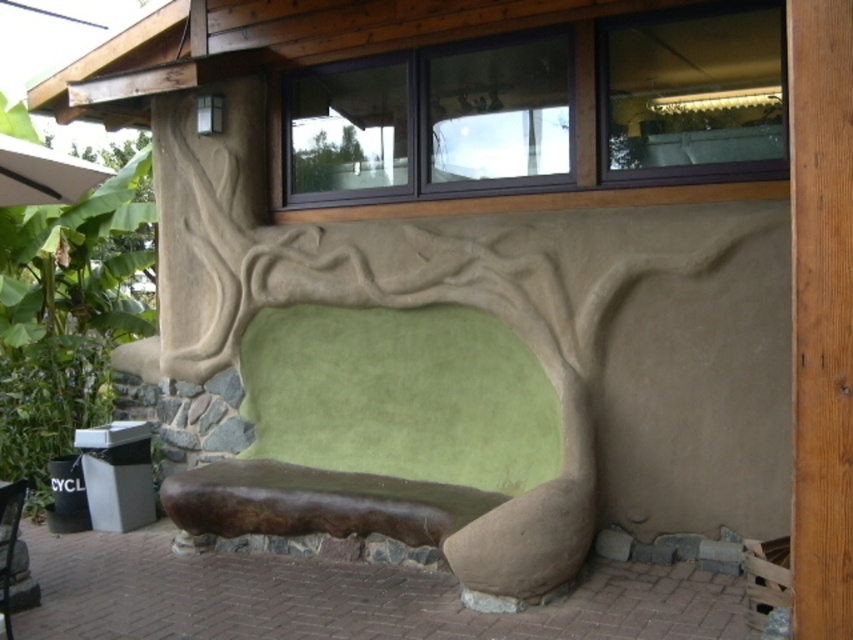
You are an architect evaluating the structural integrity of the brown wood at center and the green leafy tree at lower left. Which object has a smaller diameter?

The brown wood at center is thinner than the green leafy tree at lower left, so the brown wood at center has a smaller diameter.

From the picture: You are standing in front of the sculpted wall that looks like a tree trunk and branches. There are two points marked on the wall at coordinates point (827, 230) and point (74, 253). If you want to touch the point that is closer to you, which one should you choose?

You should choose point (827, 230) because it is closer to the camera than point (74, 253).

You are standing in front of the sculpted wall that looks like a tree trunk and branches. There is a brown wood at center marked by point (821, 314). If you want to touch the brown wood at center, which direction should you move relative to your current position?

To touch the brown wood at center marked by point (821, 314), you should move forward since the point is at the center of the wall, directly in front of you.